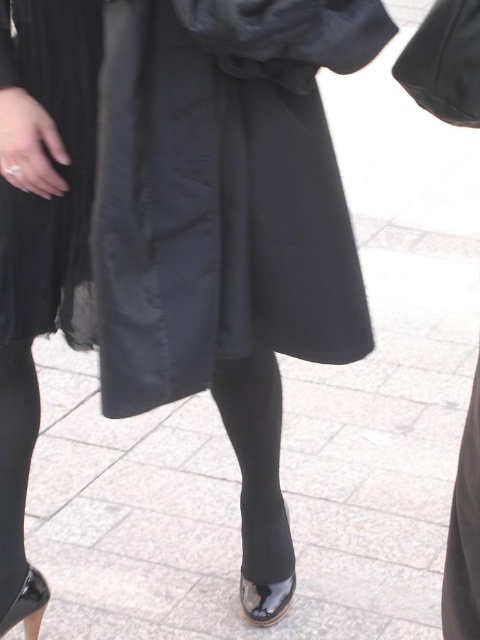
You are standing in front of the person wearing the black graduation gown. You want to see which part is closer to you between the black tights at lower left and the glossy patent leather sandal at lower left. Can you tell me?

The black tights at lower left is closer to the viewer than the glossy patent leather sandal at lower left.

You are a photographer setting up for a graduation photoshoot. You need to ensure that the black tights at lower left and the glossy patent leather sandal at lower left are both visible in the final image. Based on their current positions, is there any concern about one covering the other?

The black tights at lower left is positioned over the glossy patent leather sandal at lower left, so the sandal may be partially or fully obscured. Adjust the subject or angle to ensure both are visible.